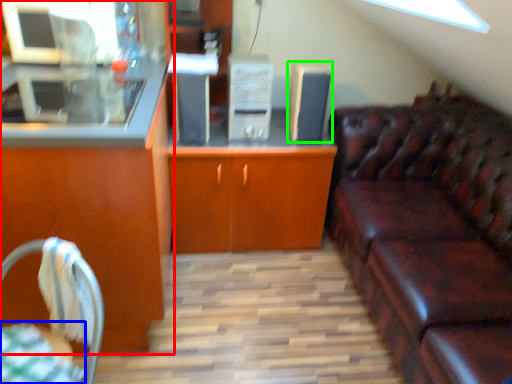
Question: Based on their relative distances, which object is nearer to cabinetry (highlighted by a red box)? Choose from tablecloth (highlighted by a blue box) and appliance (highlighted by a green box).

Choices:
 (A) tablecloth
 (B) appliance

Answer: (A)